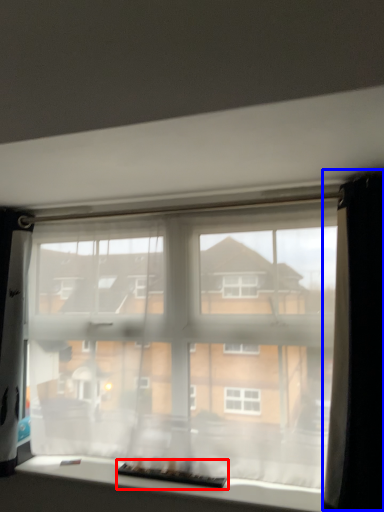
Question: Which object is closer to the camera taking this photo, level (highlighted by a red box) or curtain (highlighted by a blue box)?

Choices:
 (A) level
 (B) curtain

Answer: (B)